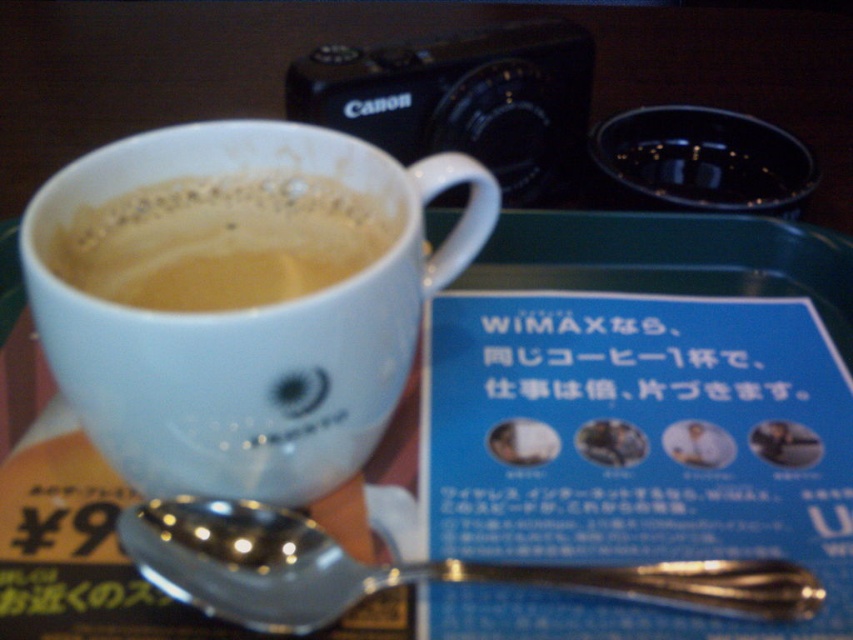
Question: Can you confirm if white glossy mug at upper center is smaller than white matte cup at upper center?

Choices:
 (A) no
 (B) yes

Answer: (A)

Question: Which point appears closest to the camera in this image?

Choices:
 (A) (167, 268)
 (B) (152, 456)
 (C) (115, 529)

Answer: (B)

Question: Which object is positioned farthest from the silver metallic spoon at lower left?

Choices:
 (A) white matte cup at upper center
 (B) white glossy mug at upper center

Answer: (A)

Question: Is white glossy mug at upper center bigger than silver metallic spoon at lower left?

Choices:
 (A) no
 (B) yes

Answer: (B)

Question: Can you confirm if silver metallic spoon at lower left is smaller than white matte cup at upper center?

Choices:
 (A) no
 (B) yes

Answer: (B)

Question: Which of the following is the closest to the observer?

Choices:
 (A) white glossy mug at upper center
 (B) silver metallic spoon at lower left
 (C) white matte cup at upper center

Answer: (A)